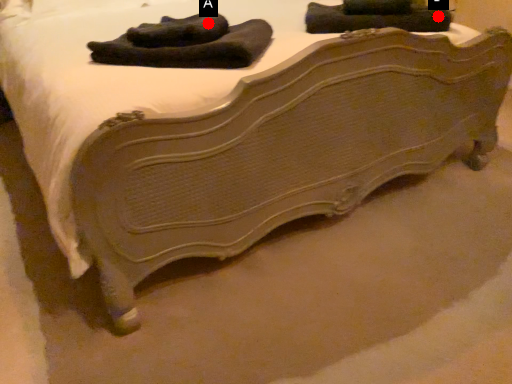
Question: Two points are circled on the image, labeled by A and B beside each circle. Which point appears closest to the camera in this image?

Choices:
 (A) A is closer
 (B) B is closer

Answer: (A)